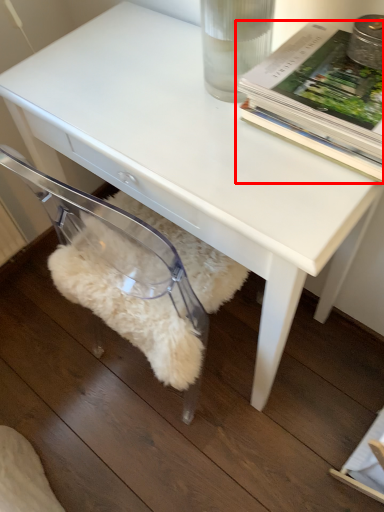
Question: From the image's perspective, what is the correct spatial relationship of book (annotated by the red box) in relation to swivel chair?

Choices:
 (A) above
 (B) below

Answer: (A)